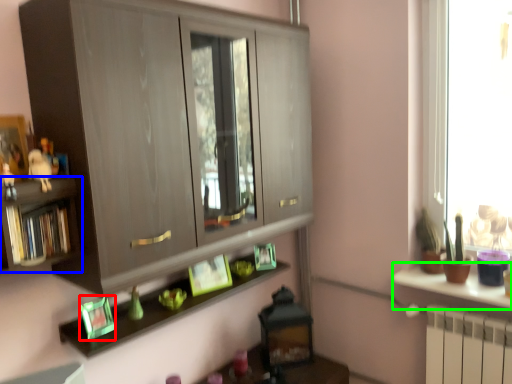
Question: Based on their relative distances, which object is farther from picture frame (highlighted by a red box)? Choose from shelf (highlighted by a blue box) and counter (highlighted by a green box).

Choices:
 (A) shelf
 (B) counter

Answer: (B)